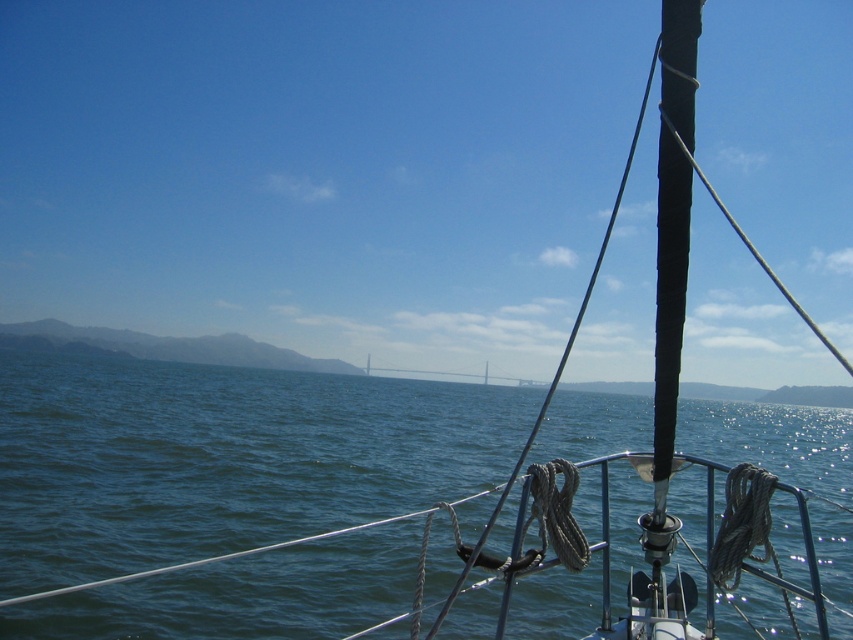
You are on a sailboat and want to know which object is nearer to you between the blue water at center and the gray metallic bridge at center. Which one is closer?

The blue water at center is closer to the viewer than the gray metallic bridge at center.

You are standing on the deck of the sailboat and want to know the position of the blue water at center relative to the mast. Can you determine if it is to the left or right of the mast?

The blue water at center is located at point (221, 458), which is to the right of the mast wrapped with black protective covering.